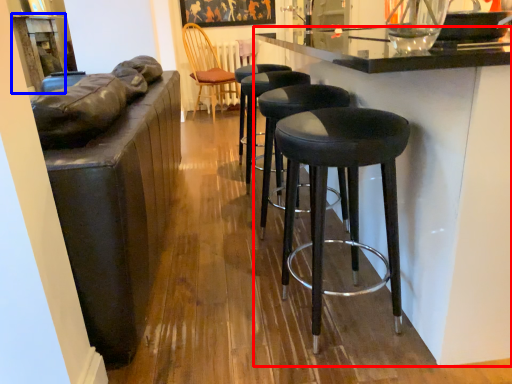
Question: Which object appears farthest to the camera in this image, counter (highlighted by a red box) or table (highlighted by a blue box)?

Choices:
 (A) counter
 (B) table

Answer: (B)